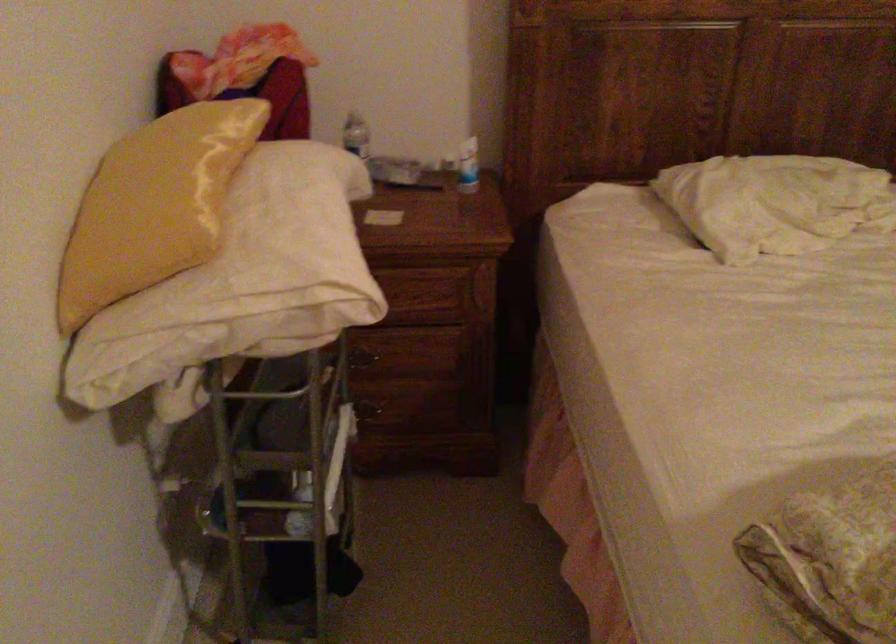
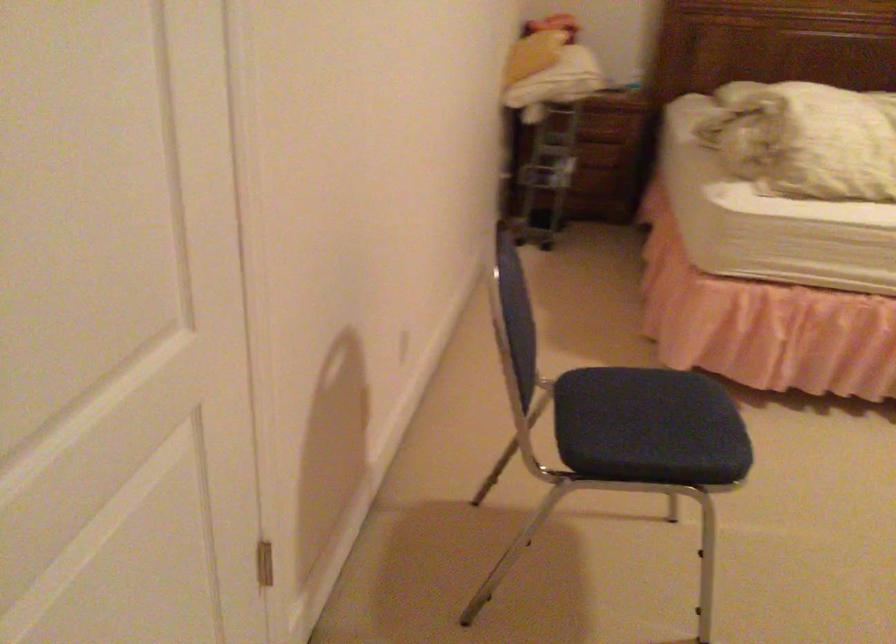
Question: What movement of the cameraman would produce the second image?

Choices:
 (A) Left
 (B) Right
 (C) Forward
 (D) Backward

Answer: (D)